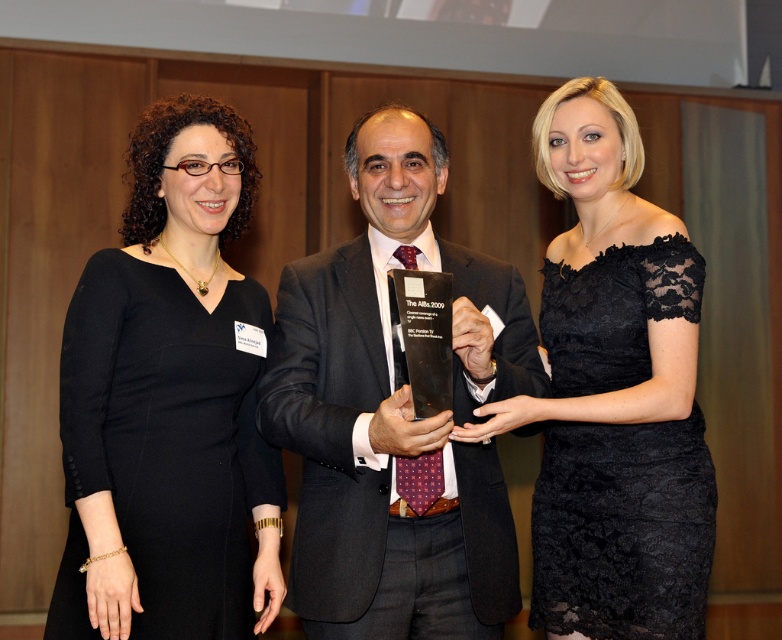
You are attending a formal event and notice two women wearing black dresses. One is wearing a black matte dress at left and the other a black lace dress at center. Which woman is standing closer to the front of the room?

The black lace dress at center is standing closer to the front of the room because the black matte dress at left is located below it, indicating it is positioned further back.